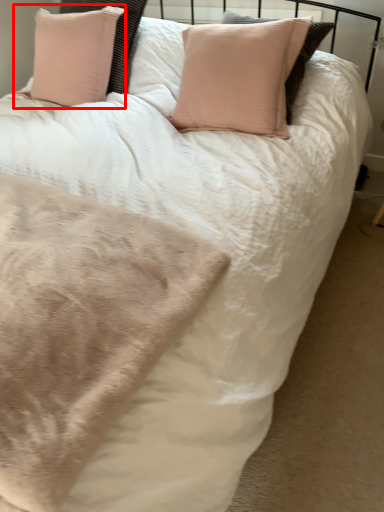
Question: In this image, where is pillow (annotated by the red box) located relative to blanket?

Choices:
 (A) left
 (B) right

Answer: (A)